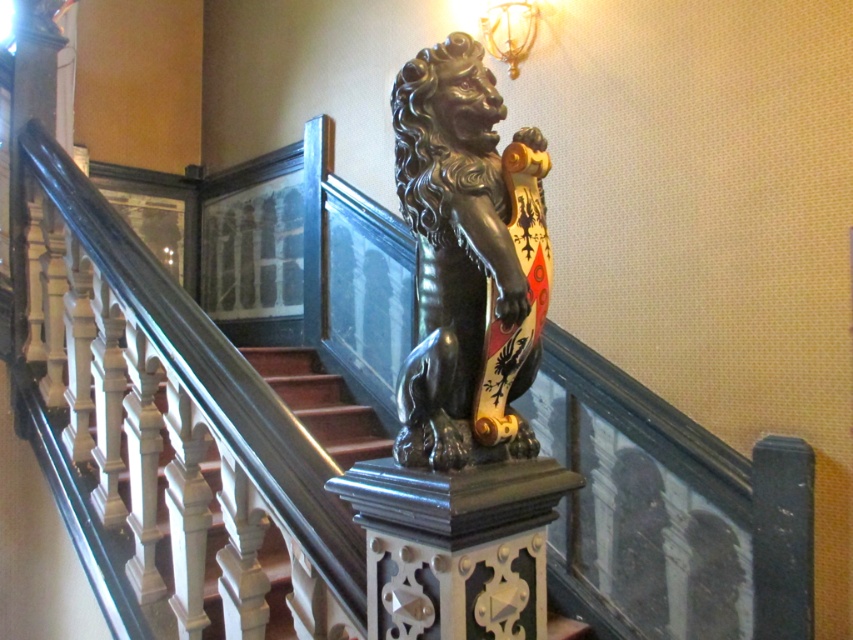
Question: Estimate the real-world distances between objects in this image. Which object is farther from the metallic gold lamp at upper center?

Choices:
 (A) polished bronze lion at center
 (B) white glossy stair at left

Answer: (A)

Question: Is polished bronze lion at center wider than white glossy stair at left?

Choices:
 (A) no
 (B) yes

Answer: (A)

Question: Can you confirm if polished bronze lion at center is positioned to the left of white glossy stair at left?

Choices:
 (A) yes
 (B) no

Answer: (B)

Question: Which of the following is the farthest from the observer?

Choices:
 (A) metallic gold lamp at upper center
 (B) white glossy stair at left
 (C) polished bronze lion at center

Answer: (A)

Question: Is polished bronze lion at center positioned before metallic gold lamp at upper center?

Choices:
 (A) no
 (B) yes

Answer: (B)

Question: Which object is the farthest from the white glossy stair at left?

Choices:
 (A) metallic gold lamp at upper center
 (B) polished bronze lion at center

Answer: (B)